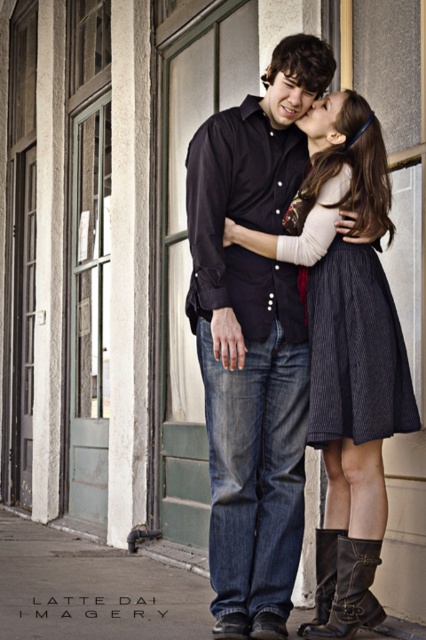
Question: From the image, what is the correct spatial relationship of dark pinstriped skirt at center in relation to brown leather boot at lower center?

Choices:
 (A) above
 (B) below

Answer: (A)

Question: Which point is farther to the camera?

Choices:
 (A) dark pinstriped skirt at center
 (B) brown leather boot at lower center

Answer: (B)

Question: Is matte black shirt at center below brown leather boot at lower center?

Choices:
 (A) no
 (B) yes

Answer: (A)

Question: From the image, what is the correct spatial relationship of dark pinstriped skirt at center in relation to black leather boot at lower right?

Choices:
 (A) below
 (B) above

Answer: (B)

Question: Among these points, which one is nearest to the camera?

Choices:
 (A) (333, 592)
 (B) (270, 125)
 (C) (365, 419)
 (D) (371, 577)

Answer: (C)

Question: Which point is farther to the camera?

Choices:
 (A) (324, 577)
 (B) (348, 608)

Answer: (A)